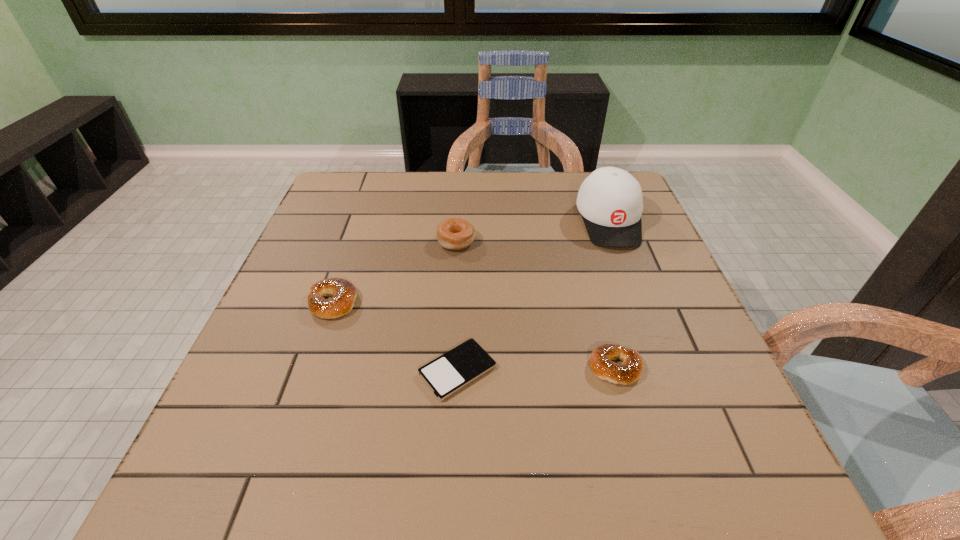
Locate an element on the screen. This screenshot has width=960, height=540. the tallest object is located at coordinates (610, 201).

Image resolution: width=960 pixels, height=540 pixels. Find the location of `the second bagel from right to left`. the second bagel from right to left is located at coordinates (455, 233).

Identify the location of the farthest bagel. The width and height of the screenshot is (960, 540). (455, 233).

Find the location of a particular element. the second nearest bagel is located at coordinates (344, 294).

The width and height of the screenshot is (960, 540). Identify the location of the second shortest bagel. (344, 294).

The image size is (960, 540). Identify the location of the rightmost bagel. (630, 370).

Identify the location of the nearest bagel. (630, 370).

The width and height of the screenshot is (960, 540). Identify the location of the shortest object. (447, 374).

Where is `vacant space located on the front-facing side of the tallest object`? vacant space located on the front-facing side of the tallest object is located at coordinates coord(649,330).

You are a GUI agent. You are given a task and a screenshot of the screen. Output one action in this format:
    pyautogui.click(x=<x>, y=<y>)
    Task: Click on the vacant space located 0.170m on the right of the second tallest object
    This screenshot has width=960, height=540.
    Given the screenshot: What is the action you would take?
    pyautogui.click(x=542, y=241)